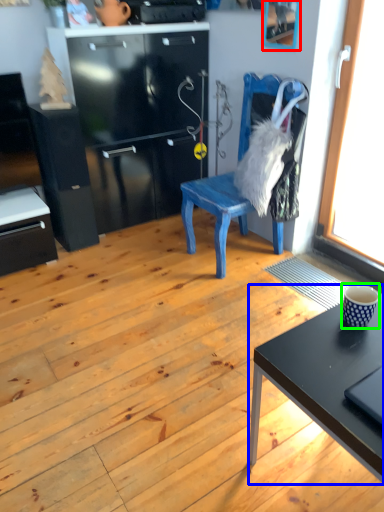
Question: Which object is the farthest from picture frame (highlighted by a red box)? Choose among these: desk (highlighted by a blue box) or coffee cup (highlighted by a green box).

Choices:
 (A) desk
 (B) coffee cup

Answer: (A)